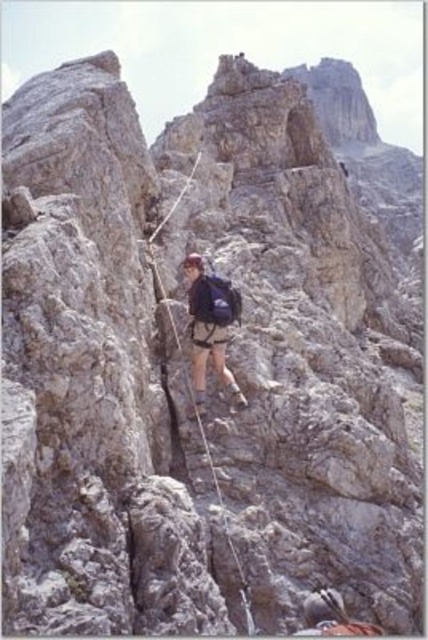
Question: Observing the image, what is the correct spatial positioning of matte blue backpack at center in reference to black nylon rope at center?

Choices:
 (A) left
 (B) right

Answer: (B)

Question: Can you confirm if matte blue backpack at center is positioned below black nylon rope at center?

Choices:
 (A) yes
 (B) no

Answer: (B)

Question: Which object is farther from the camera taking this photo?

Choices:
 (A) matte blue backpack at center
 (B) black nylon rope at center

Answer: (A)

Question: Which point is closer to the camera?

Choices:
 (A) (202, 426)
 (B) (193, 337)

Answer: (A)

Question: Is matte blue backpack at center wider than black nylon rope at center?

Choices:
 (A) no
 (B) yes

Answer: (A)